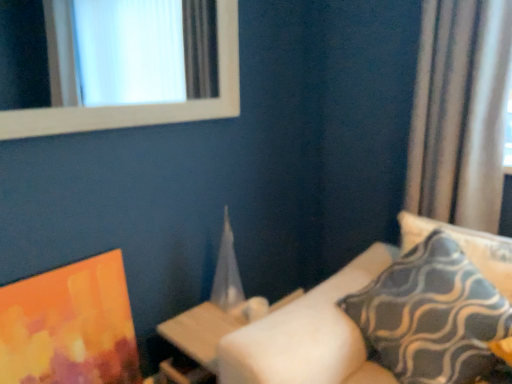
Question: Is patterned fabric pillow at right, which ranks as the 1th pillow in left-to-right order, smaller than blue-patterned fabric pillow at right, arranged as the first pillow when viewed from the right?

Choices:
 (A) no
 (B) yes

Answer: (A)

Question: Can you confirm if patterned fabric pillow at right, which is counted as the 2th pillow, starting from the right, is wider than blue-patterned fabric pillow at right, positioned as the second pillow in left-to-right order?

Choices:
 (A) no
 (B) yes

Answer: (B)

Question: Does patterned fabric pillow at right, which is counted as the 2th pillow, starting from the right, appear on the left side of blue-patterned fabric pillow at right, positioned as the second pillow in left-to-right order?

Choices:
 (A) yes
 (B) no

Answer: (A)

Question: Are patterned fabric pillow at right, which ranks as the 1th pillow in left-to-right order, and blue-patterned fabric pillow at right, arranged as the first pillow when viewed from the right, located far from each other?

Choices:
 (A) no
 (B) yes

Answer: (A)

Question: Is blue-patterned fabric pillow at right, positioned as the second pillow in left-to-right order, completely or partially inside patterned fabric pillow at right, which ranks as the 1th pillow in left-to-right order?

Choices:
 (A) no
 (B) yes

Answer: (A)

Question: Considering the positions of white wooden frame at upper left and blue-patterned fabric pillow at right, positioned as the second pillow in left-to-right order, in the image, is white wooden frame at upper left taller or shorter than blue-patterned fabric pillow at right, positioned as the second pillow in left-to-right order,?

Choices:
 (A) tall
 (B) short

Answer: (A)

Question: From a real-world perspective, is white wooden frame at upper left above or below blue-patterned fabric pillow at right, positioned as the second pillow in left-to-right order?

Choices:
 (A) above
 (B) below

Answer: (A)

Question: In terms of width, does white wooden frame at upper left look wider or thinner when compared to blue-patterned fabric pillow at right, arranged as the first pillow when viewed from the right?

Choices:
 (A) thin
 (B) wide

Answer: (A)

Question: In the image, is white wooden frame at upper left on the left side or the right side of blue-patterned fabric pillow at right, positioned as the second pillow in left-to-right order?

Choices:
 (A) left
 (B) right

Answer: (A)

Question: Considering their positions, is blue-patterned fabric pillow at right, positioned as the second pillow in left-to-right order, located in front of or behind wooden table at center?

Choices:
 (A) behind
 (B) front

Answer: (B)

Question: In terms of size, does blue-patterned fabric pillow at right, positioned as the second pillow in left-to-right order, appear bigger or smaller than wooden table at center?

Choices:
 (A) small
 (B) big

Answer: (A)

Question: Does point (507, 289) appear closer or farther from the camera than point (195, 339)?

Choices:
 (A) farther
 (B) closer

Answer: (B)

Question: Is blue-patterned fabric pillow at right, arranged as the first pillow when viewed from the right, wider or thinner than wooden table at center?

Choices:
 (A) thin
 (B) wide

Answer: (A)

Question: Is patterned fabric pillow at right, which is counted as the 2th pillow, starting from the right, situated inside matte orange painting at lower left or outside?

Choices:
 (A) outside
 (B) inside

Answer: (A)

Question: From the image's perspective, is patterned fabric pillow at right, which is counted as the 2th pillow, starting from the right, positioned above or below matte orange painting at lower left?

Choices:
 (A) below
 (B) above

Answer: (B)